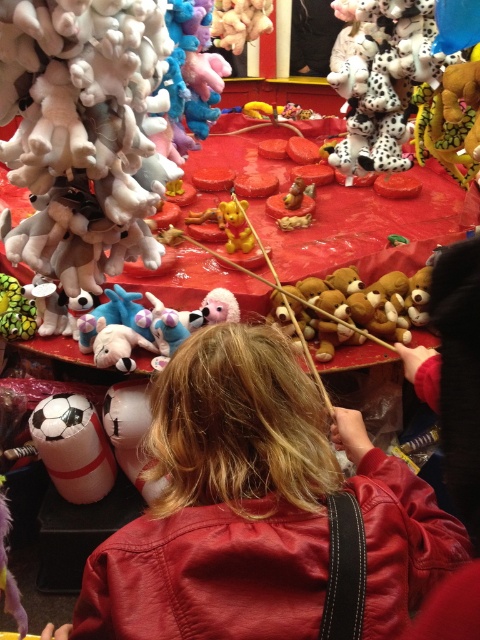
Question: Considering the relative positions of leather jacket at center and green fuzzy plush at left in the image provided, where is leather jacket at center located with respect to green fuzzy plush at left?

Choices:
 (A) below
 (B) above

Answer: (A)

Question: Is soft plush teddy bear at center below white matte soccer ball at lower left?

Choices:
 (A) no
 (B) yes

Answer: (A)

Question: Estimate the real-world distances between objects in this image. Which object is closer to the leather jacket at center?

Choices:
 (A) green fuzzy plush at left
 (B) soft plush teddy bear at center
 (C) white matte soccer ball at lower left
 (D) soft plush bear at center

Answer: (B)

Question: Is soft plush teddy bear at center wider than green fuzzy plush at left?

Choices:
 (A) no
 (B) yes

Answer: (B)

Question: Which object is positioned farthest from the soft plush teddy bear at center?

Choices:
 (A) white matte soccer ball at lower left
 (B) green fuzzy plush at left
 (C) soft plush bear at center

Answer: (B)

Question: Which of the following is the farthest from the observer?

Choices:
 (A) (6, 301)
 (B) (244, 244)

Answer: (B)